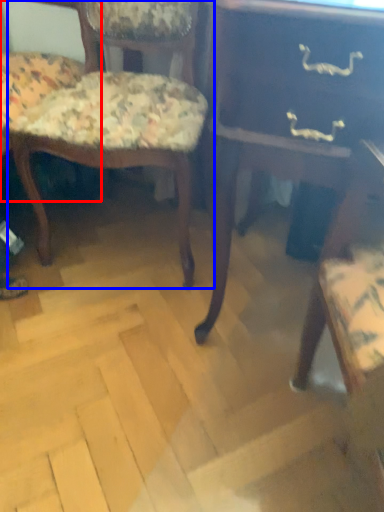
Question: Which object is closer to the camera taking this photo, chair (highlighted by a red box) or chair (highlighted by a blue box)?

Choices:
 (A) chair
 (B) chair

Answer: (A)